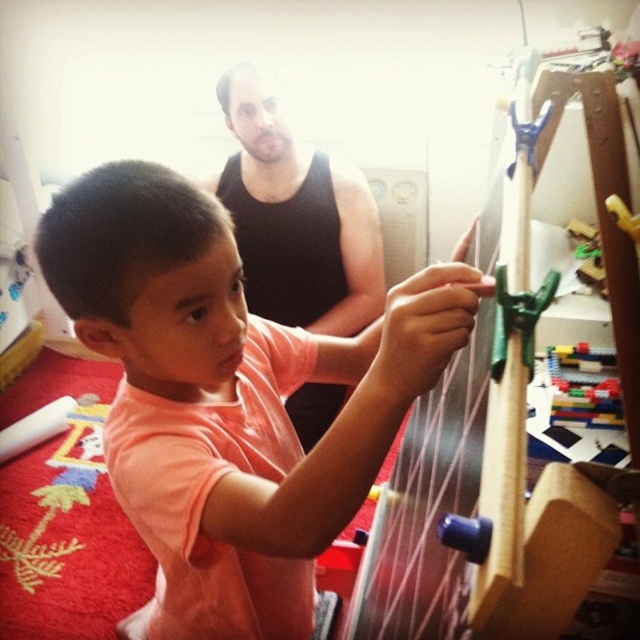
Question: Can you confirm if pink matte shirt at center is bigger than translucent plastic blocks at upper right?

Choices:
 (A) yes
 (B) no

Answer: (A)

Question: Among these objects, which one is nearest to the camera?

Choices:
 (A) translucent plastic blocks at upper right
 (B) black tank top at upper center
 (C) pink matte shirt at center

Answer: (C)

Question: Which object is closer to the camera taking this photo?

Choices:
 (A) pink matte shirt at center
 (B) translucent plastic blocks at upper right

Answer: (A)

Question: Is pink matte shirt at center positioned before translucent plastic blocks at upper right?

Choices:
 (A) no
 (B) yes

Answer: (B)

Question: Is black tank top at upper center bigger than translucent plastic blocks at upper right?

Choices:
 (A) no
 (B) yes

Answer: (B)

Question: Which point appears farthest from the camera in this image?

Choices:
 (A) (576, 420)
 (B) (320, 269)

Answer: (A)